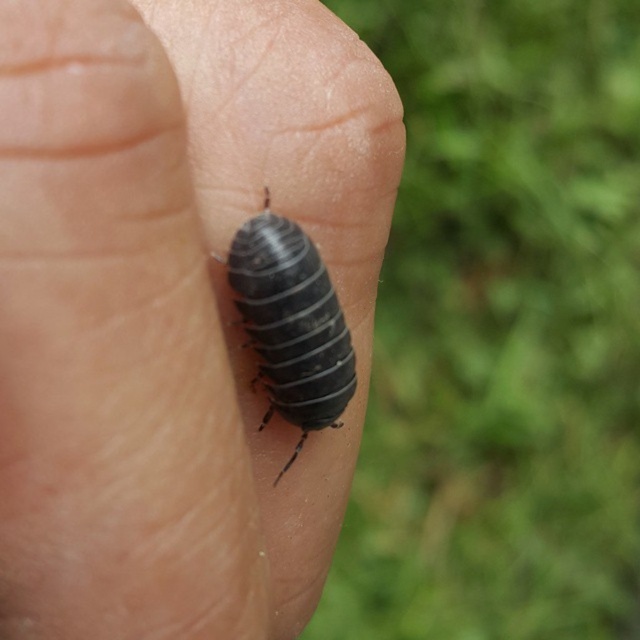
Question: Is the position of matte black bug at center more distant than that of shiny black beetle at center?

Choices:
 (A) yes
 (B) no

Answer: (B)

Question: Does matte black bug at center appear over shiny black beetle at center?

Choices:
 (A) no
 (B) yes

Answer: (A)

Question: Which object is farther from the camera taking this photo?

Choices:
 (A) matte black bug at center
 (B) shiny black beetle at center

Answer: (B)

Question: Which point is closer to the camera?

Choices:
 (A) shiny black beetle at center
 (B) matte black bug at center

Answer: (B)

Question: Is matte black bug at center smaller than shiny black beetle at center?

Choices:
 (A) yes
 (B) no

Answer: (B)